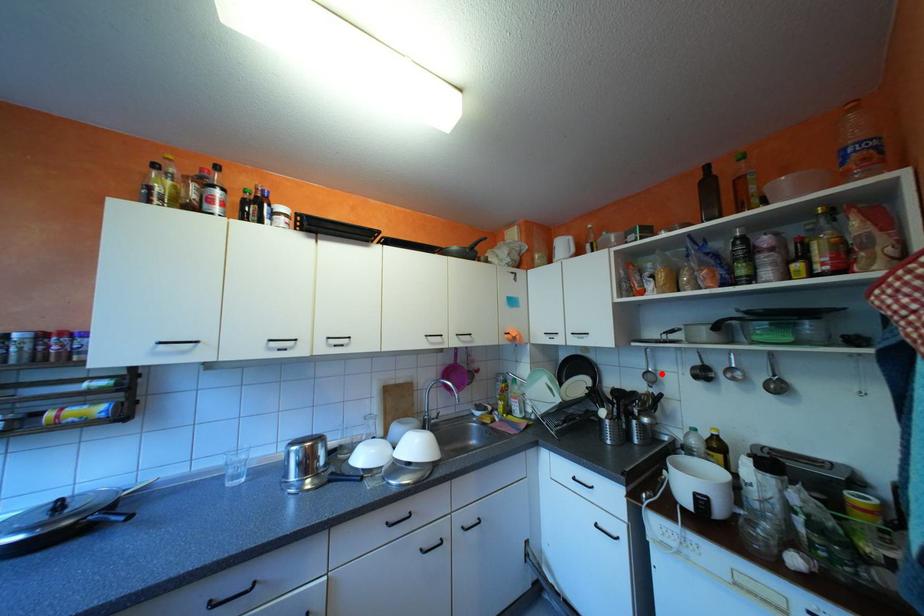
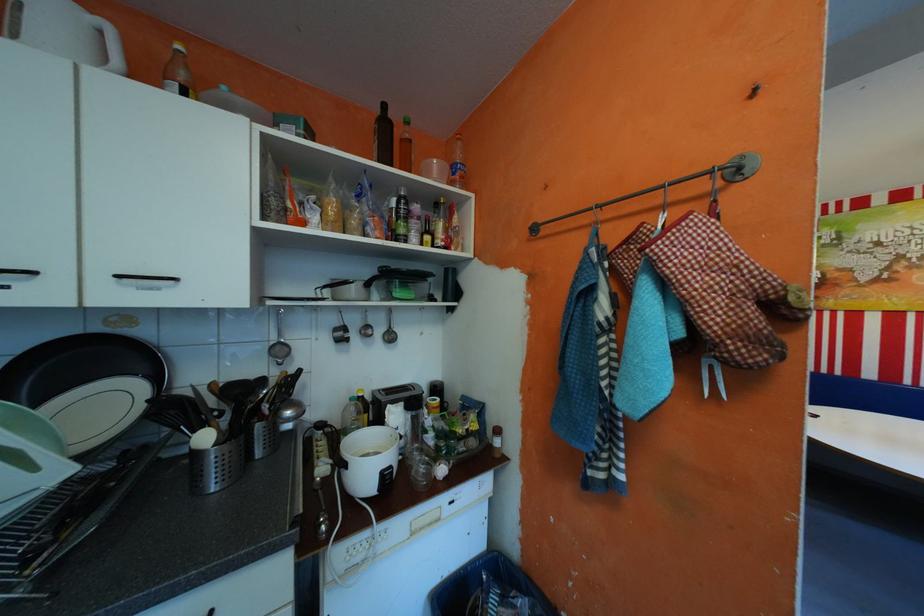
Question: I am providing you with two images of the same scene from different viewpoints. A red point is marked on the first image. At the location where the point appears in image 1, is it still visible in image 2?

Choices:
 (A) Yes
 (B) No

Answer: (A)